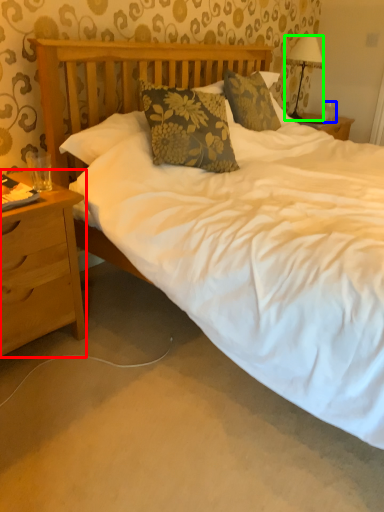
Question: Based on their relative distances, which object is nearer to nightstand (highlighted by a red box)? Choose from coffee cup (highlighted by a blue box) and lamp (highlighted by a green box).

Choices:
 (A) coffee cup
 (B) lamp

Answer: (B)